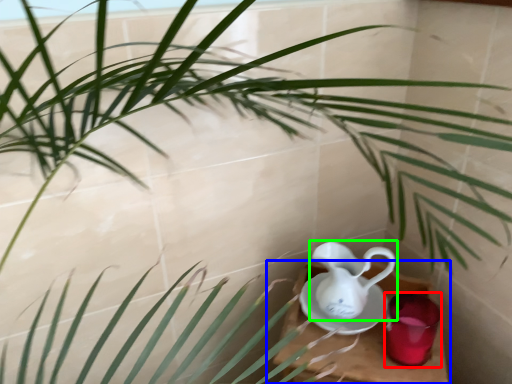
Question: Based on their relative distances, which object is farther from tableware (highlighted by a red box)? Choose from table (highlighted by a blue box) and jug (highlighted by a green box).

Choices:
 (A) table
 (B) jug

Answer: (B)